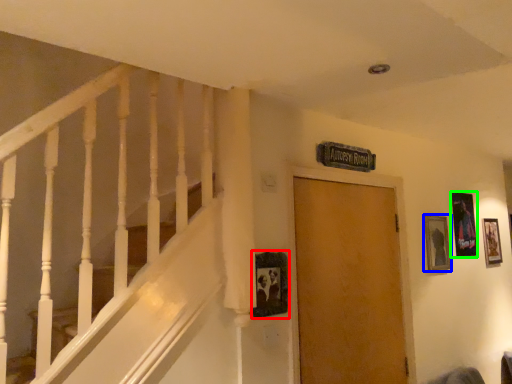
Question: Which object is positioned closest to picture frame (highlighted by a red box)? Select from picture frame (highlighted by a blue box) and picture frame (highlighted by a green box).

Choices:
 (A) picture frame
 (B) picture frame

Answer: (A)